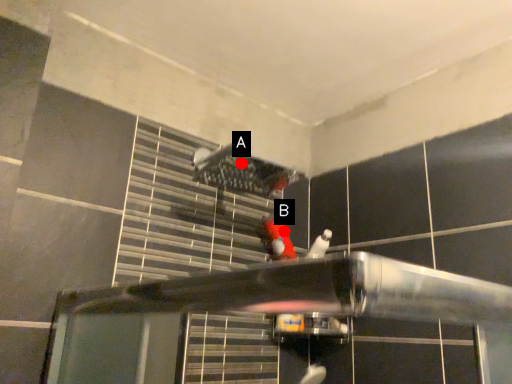
Question: Two points are circled on the image, labeled by A and B beside each circle. Which point appears farthest from the camera in this image?

Choices:
 (A) A is further
 (B) B is further

Answer: (B)